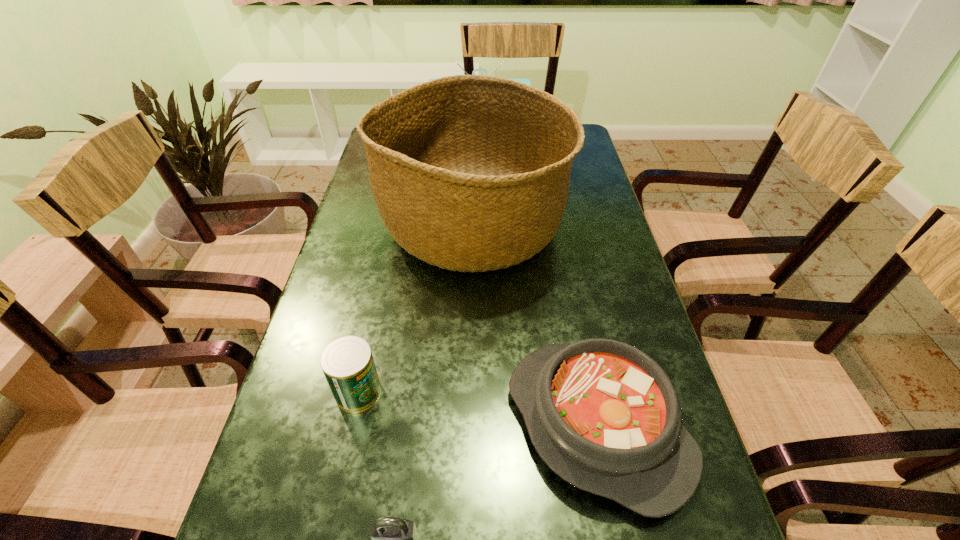
At what (x,y) coordinates should I click in order to perform the action: click on object that is the third nearest to the fourth shortest object. Please return your answer as a coordinate pair (x, y). The width and height of the screenshot is (960, 540). Looking at the image, I should click on (347, 362).